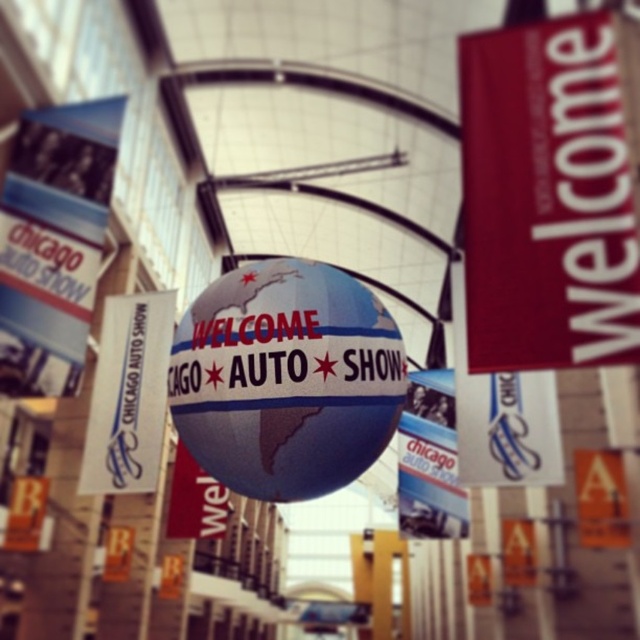
You are a photographer setting up a shot at the Chicago Auto Show. You want to capture both the red matte welcome sign at upper right and the shiny metallic globe at center in your frame. Which object should you focus on first if you want to ensure both are in focus without adjusting your camera settings?

The red matte welcome sign at upper right is much taller than the shiny metallic globe at center. Therefore, focusing on the larger object first, the red matte welcome sign at upper right, will help ensure both are in focus since it requires a smaller depth of field adjustment.